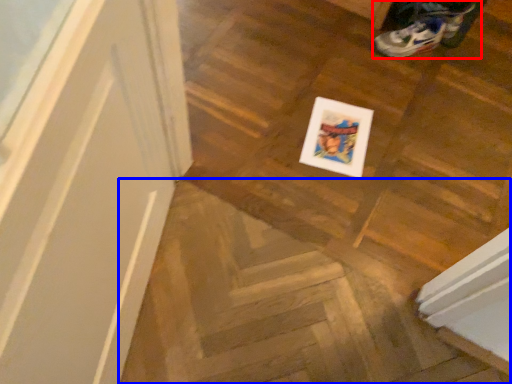
Question: Which object appears closest to the camera in this image, footwear (highlighted by a red box) or stairwell (highlighted by a blue box)?

Choices:
 (A) footwear
 (B) stairwell

Answer: (B)